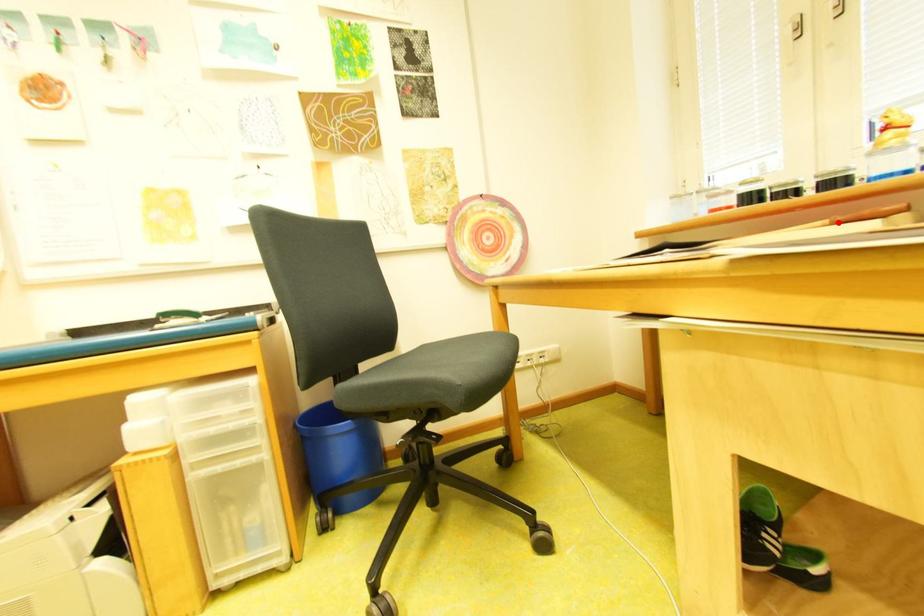
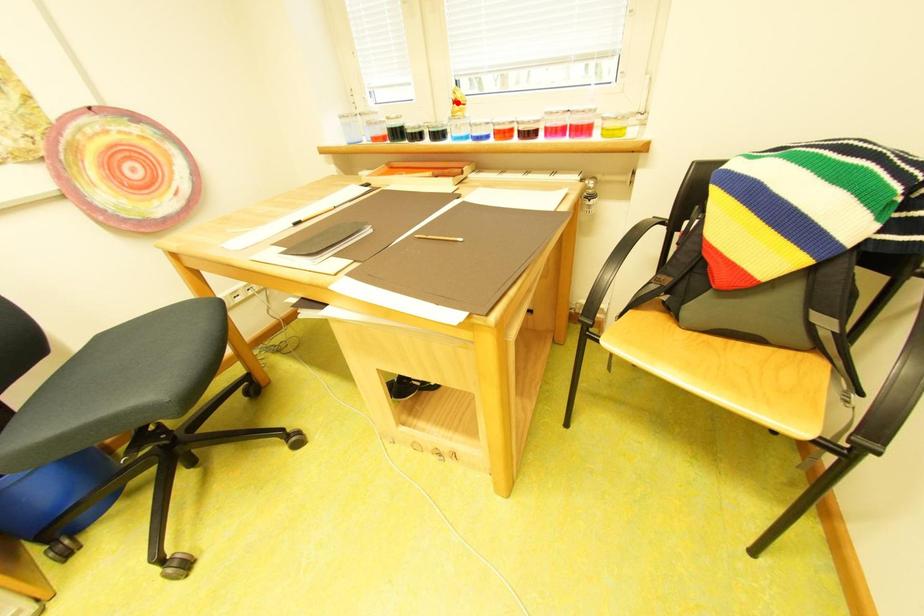
I am providing you with two images of the same scene from different viewpoints. A red point is marked on the first image and another point is marked on the second image. Is the marked point in image1 the same physical position as the marked point in image2?

No